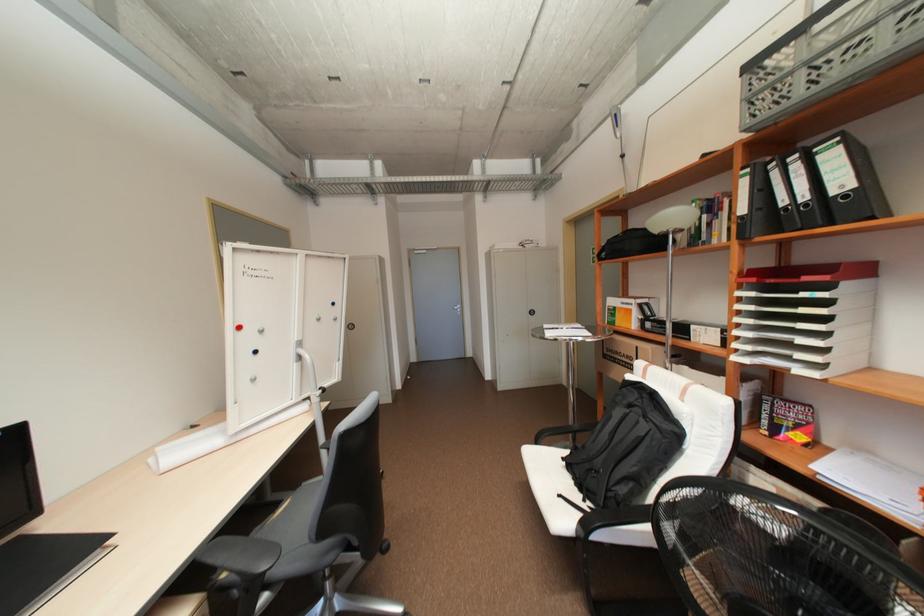
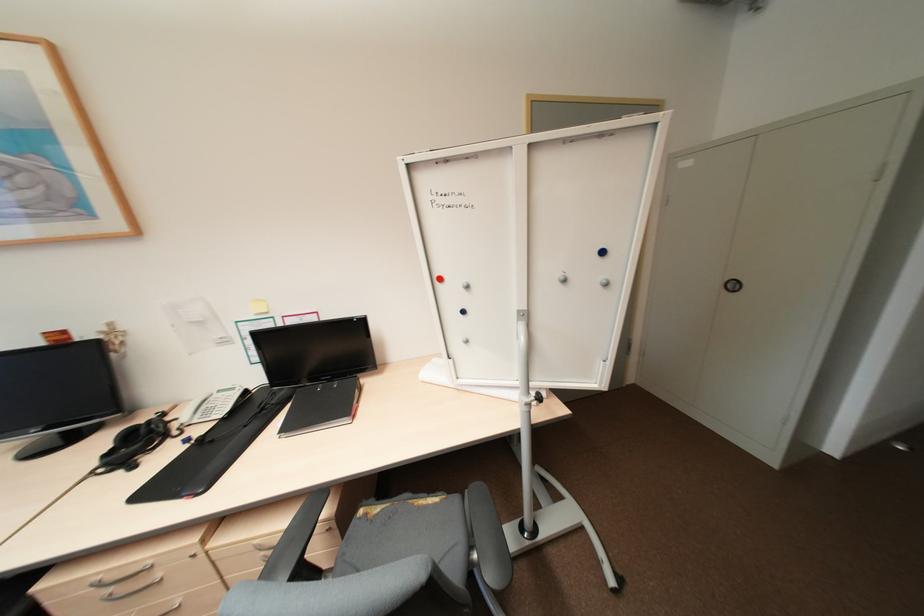
The point at (323, 400) is marked in the first image. Where is the corresponding point in the second image?

(531, 408)